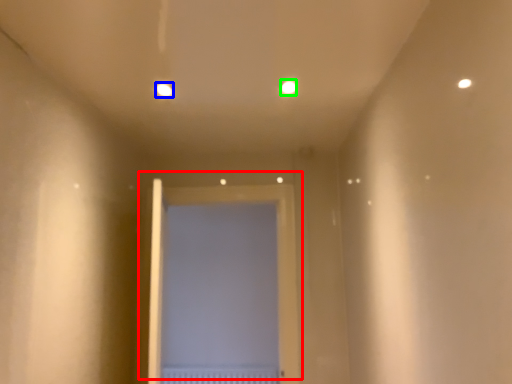
Question: Which is nearer to the door (highlighted by a red box)? light (highlighted by a blue box) or light (highlighted by a green box).

Choices:
 (A) light
 (B) light

Answer: (B)